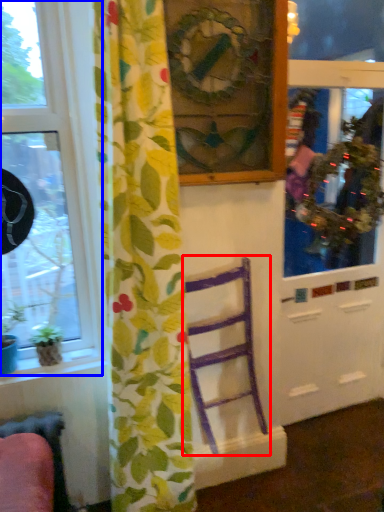
Question: Which object is closer to the camera taking this photo, furniture (highlighted by a red box) or window (highlighted by a blue box)?

Choices:
 (A) furniture
 (B) window

Answer: (B)